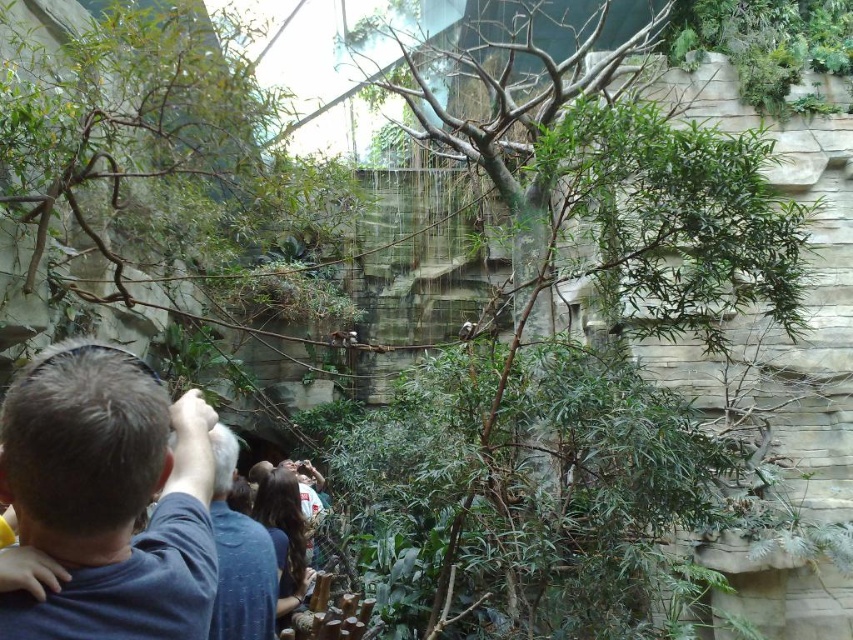
You are a photographer trying to capture a clear shot of the dark blue shirt at center and the dark brown hair at center. Which object would you need to focus on first if you want to ensure both are in focus?

The dark blue shirt at center is bigger than dark brown hair at center, so you should focus on the dark blue shirt at center first to ensure both are in focus.

You are a zookeeper trying to locate two visitors wearing dark blue shirts. You see the dark blue shirt at lower left and the dark blue shirt at center. Which one is positioned more to the left?

The dark blue shirt at lower left is positioned more to the left compared to the dark blue shirt at center.